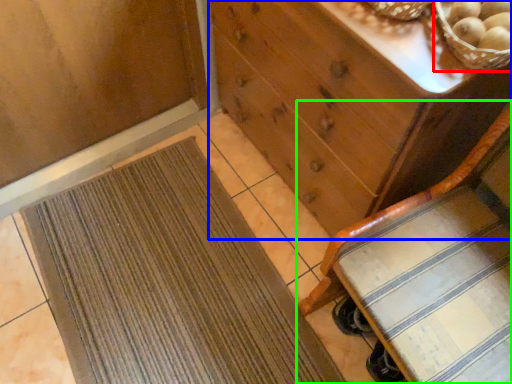
Question: Which object is the closest to the basket (highlighted by a red box)? Choose among these: chest of drawers (highlighted by a blue box) or furniture (highlighted by a green box).

Choices:
 (A) chest of drawers
 (B) furniture

Answer: (A)